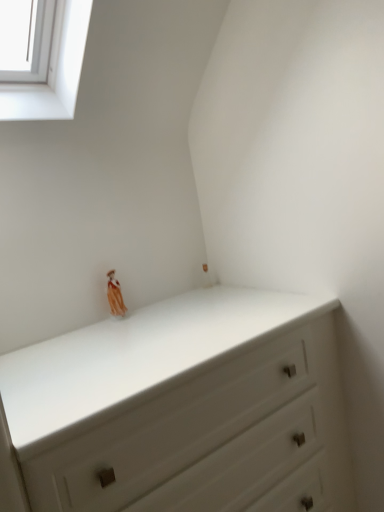
What do you see at coordinates (185, 409) in the screenshot? The width and height of the screenshot is (384, 512). I see `white matte chest of drawers at center` at bounding box center [185, 409].

What do you see at coordinates (53, 70) in the screenshot?
I see `white glass window at upper left` at bounding box center [53, 70].

The width and height of the screenshot is (384, 512). I want to click on white matte chest of drawers at center, so click(x=185, y=409).

From a real-world perspective, is matte orange figurine at upper center physically located above or below white glass window at upper left?

Clearly, from a real-world perspective, matte orange figurine at upper center is below white glass window at upper left.

Is matte orange figurine at upper center to the right of white glass window at upper left from the viewer's perspective?

Indeed, matte orange figurine at upper center is positioned on the right side of white glass window at upper left.

Consider the image. Considering the relative positions of matte orange figurine at upper center and white glass window at upper left in the image provided, is matte orange figurine at upper center behind white glass window at upper left?

Yes, matte orange figurine at upper center is behind white glass window at upper left.

You are a GUI agent. You are given a task and a screenshot of the screen. Output one action in this format:
    pyautogui.click(x=<x>, y=<y>)
    Task: Click on the miniature located below the white glass window at upper left (from the image's perspective)
    The width and height of the screenshot is (384, 512).
    Given the screenshot: What is the action you would take?
    pyautogui.click(x=115, y=295)

Who is smaller, white matte chest of drawers at center or matte orange figurine at upper center?

With smaller size is matte orange figurine at upper center.

How different are the orientations of white matte chest of drawers at center and matte orange figurine at upper center in degrees?

The angular difference between white matte chest of drawers at center and matte orange figurine at upper center is 0.114 degrees.

Is white matte chest of drawers at center wider or thinner than matte orange figurine at upper center?

white matte chest of drawers at center is wider than matte orange figurine at upper center.

Is matte orange figurine at upper center not near white matte chest of drawers at center?

They are positioned close to each other.

Would you say white matte chest of drawers at center is part of matte orange figurine at upper center's contents?

Definitely not — white matte chest of drawers at center is not inside matte orange figurine at upper center.

Considering the points (107, 293) and (239, 457), which point is behind, point (107, 293) or point (239, 457)?

Positioned behind is point (107, 293).

Who is smaller, white glass window at upper left or white matte chest of drawers at center?

With smaller size is white glass window at upper left.

Is white glass window at upper left to the right of white matte chest of drawers at center from the viewer's perspective?

No, white glass window at upper left is not to the right of white matte chest of drawers at center.

Measure the distance from white glass window at upper left to white matte chest of drawers at center.

white glass window at upper left is 1.01 meters from white matte chest of drawers at center.

Would you consider white glass window at upper left to be distant from white matte chest of drawers at center?

That's right, there is a large distance between white glass window at upper left and white matte chest of drawers at center.

Would you say white matte chest of drawers at center is to the left or to the right of white glass window at upper left in the picture?

white matte chest of drawers at center is to the right of white glass window at upper left.

Looking at the image, does white matte chest of drawers at center seem bigger or smaller compared to white glass window at upper left?

Considering their sizes, white matte chest of drawers at center takes up more space than white glass window at upper left.

In order to click on window that is above the white matte chest of drawers at center (from the image's perspective) in this screenshot , I will do `click(53, 70)`.

Who is taller, white matte chest of drawers at center or white glass window at upper left?

white matte chest of drawers at center is taller.

Is white glass window at upper left situated inside matte orange figurine at upper center or outside?

white glass window at upper left cannot be found inside matte orange figurine at upper center.

Which object is closer to the camera, white glass window at upper left or matte orange figurine at upper center?

Positioned in front is white glass window at upper left.

Is white glass window at upper left facing away from matte orange figurine at upper center?

No, matte orange figurine at upper center is not at the back of white glass window at upper left.

This screenshot has width=384, height=512. I want to click on miniature behind the white glass window at upper left, so click(x=115, y=295).

This screenshot has height=512, width=384. What are the coordinates of `miniature that is under the white glass window at upper left (from a real-world perspective)` in the screenshot? It's located at (115, 295).

This screenshot has height=512, width=384. In order to click on miniature above the white matte chest of drawers at center (from a real-world perspective) in this screenshot , I will do tap(115, 295).

Which object lies further to the anchor point white glass window at upper left, white matte chest of drawers at center or matte orange figurine at upper center?

white matte chest of drawers at center is further to white glass window at upper left.

From the image, which object appears to be farther from matte orange figurine at upper center, white matte chest of drawers at center or white glass window at upper left?

white glass window at upper left is further to matte orange figurine at upper center.

From the image, which object appears to be farther from matte orange figurine at upper center, white glass window at upper left or white matte chest of drawers at center?

white glass window at upper left lies further to matte orange figurine at upper center than the other object.

Considering their positions, is matte orange figurine at upper center positioned closer to white matte chest of drawers at center than white glass window at upper left?

Among the two, matte orange figurine at upper center is located nearer to white matte chest of drawers at center.

Considering their positions, is matte orange figurine at upper center positioned further to white glass window at upper left than white matte chest of drawers at center?

white matte chest of drawers at center lies further to white glass window at upper left than the other object.

When comparing their distances from white matte chest of drawers at center, does white glass window at upper left or matte orange figurine at upper center seem closer?

matte orange figurine at upper center.

You are a GUI agent. You are given a task and a screenshot of the screen. Output one action in this format:
    pyautogui.click(x=<x>, y=<y>)
    Task: Click on the miniature between white glass window at upper left and white matte chest of drawers at center vertically
    Image resolution: width=384 pixels, height=512 pixels.
    Given the screenshot: What is the action you would take?
    pyautogui.click(x=115, y=295)